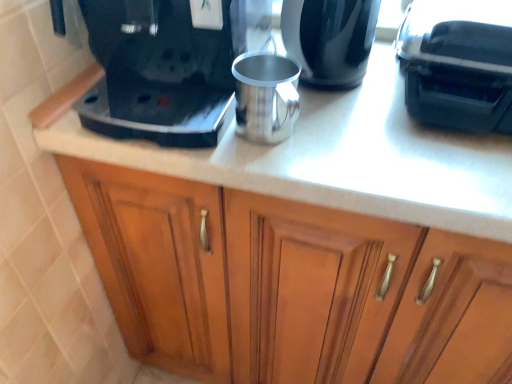
This screenshot has width=512, height=384. In order to click on free space that is in between black plastic coffee machine at upper right and shiny black kettle at upper center in this screenshot , I will do `click(376, 84)`.